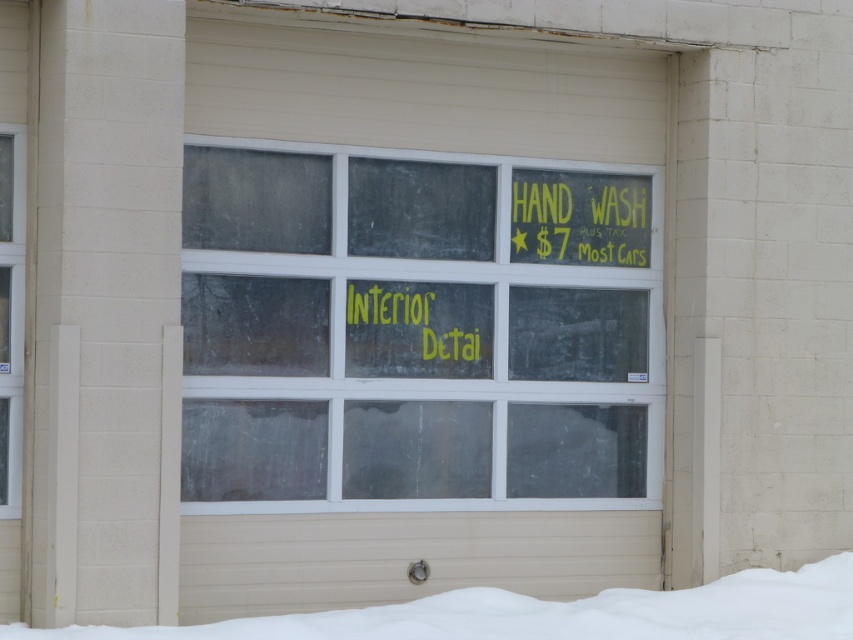
Looking at this image, who is positioned more to the left, white fluffy snow at bottom or clear glass door at left?

From the viewer's perspective, clear glass door at left appears more on the left side.

Is point (62, 636) positioned behind point (21, 397)?

That is False.

What are the coordinates of `white fluffy snow at bottom` in the screenshot? It's located at (555, 612).

Between white fluffy snow at bottom and yellow chalkboard sign at upper right, which one has more height?

Standing taller between the two is yellow chalkboard sign at upper right.

Consider the image. Is white fluffy snow at bottom positioned at the back of yellow chalkboard sign at upper right?

That is False.

Who is more distant from viewer, (415, 614) or (614, 243)?

The point (614, 243) is behind.

The height and width of the screenshot is (640, 853). Identify the location of white fluffy snow at bottom. (555, 612).

Between transparent glass window at center and white fluffy snow at bottom, which one appears on the left side from the viewer's perspective?

From the viewer's perspective, transparent glass window at center appears more on the left side.

Does point (236, 348) come in front of point (827, 579)?

That is True.

This screenshot has width=853, height=640. Find the location of `transparent glass window at center`. transparent glass window at center is located at coordinates (416, 330).

Locate an element on the screen. This screenshot has height=640, width=853. transparent glass window at center is located at coordinates (416, 330).